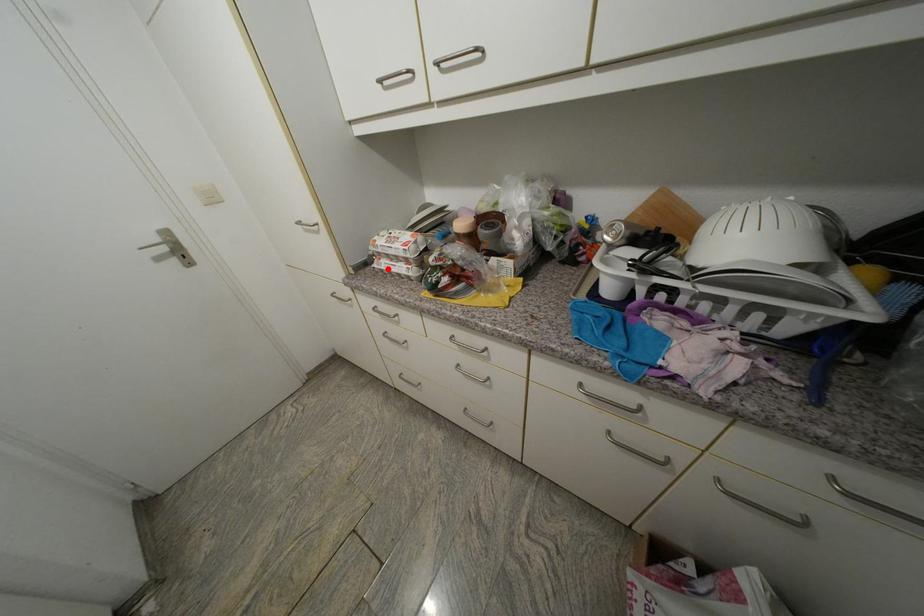
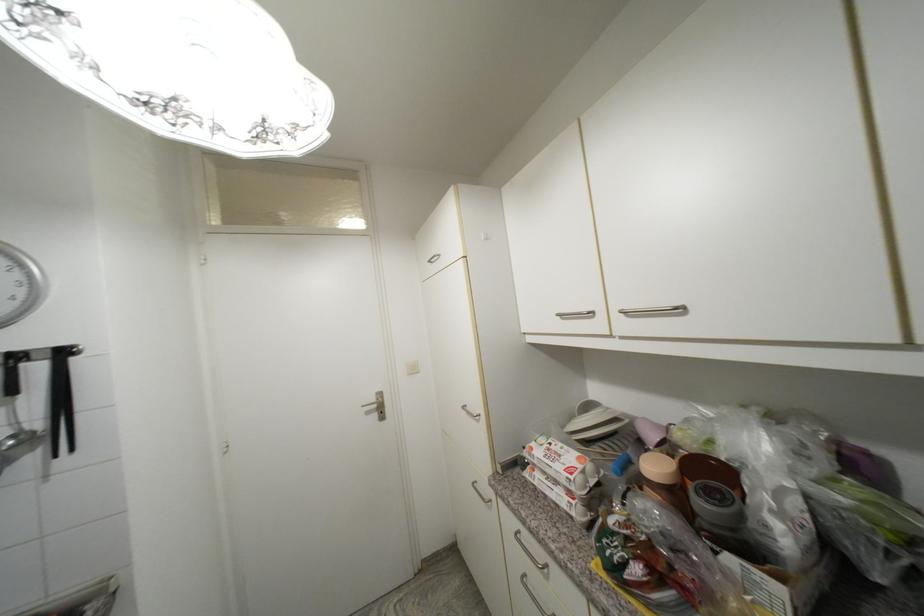
Question: I am providing you with two images of the same scene from different viewpoints. Given a red point in image1, look at the same physical point in image2. Is it:

Choices:
 (A) Closer to the viewpoint
 (B) Farther from the viewpoint

Answer: (B)